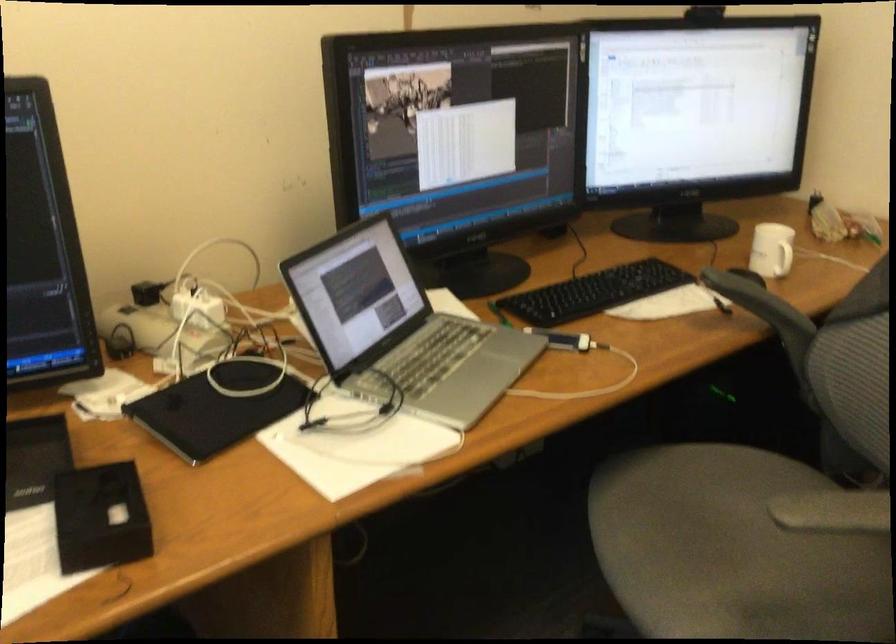
Locate an element on the screen. Image resolution: width=896 pixels, height=644 pixels. black chair armrest is located at coordinates (777, 366).